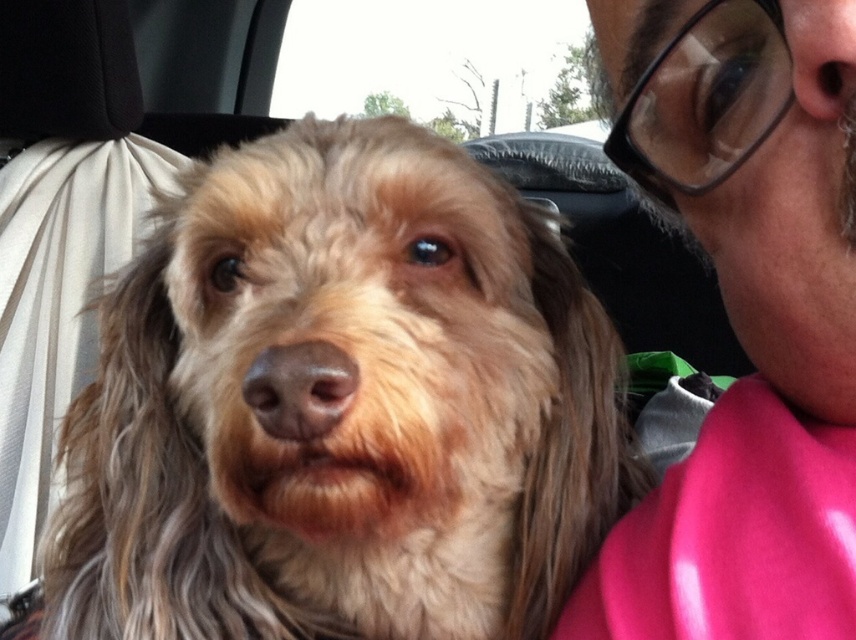
You are a passenger in the vehicle and want to adjust your glasses. The matte black glasses at upper left are at position coordinates. Can you reach them without moving your head?

The matte black glasses at upper left are located at coordinates point (744, 317), so yes, you can reach them without moving your head since they are within arm reach.

Based on the photo, you are a delivery robot standing outside the car. You need to deliver a package to the driver inside the car. The package is 1.8 meters wide. Can you fit the package through the space between the fuzzy brown dog at center and the transparent glass car window at upper center?

The space between the fuzzy brown dog at center and the transparent glass car window at upper center is 1.81 meters. Since the package is 1.8 meters wide, it can fit through the space as the width of the space is slightly larger than the package.